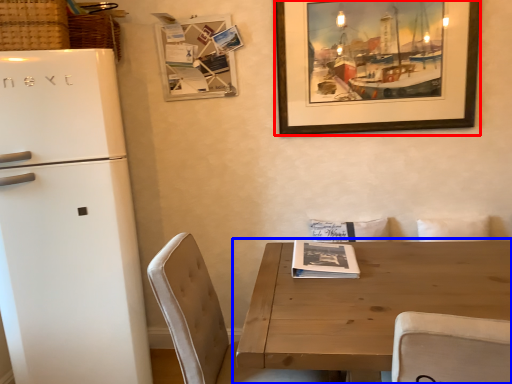
Question: Which object is closer to the camera taking this photo, picture frame (highlighted by a red box) or table (highlighted by a blue box)?

Choices:
 (A) picture frame
 (B) table

Answer: (B)